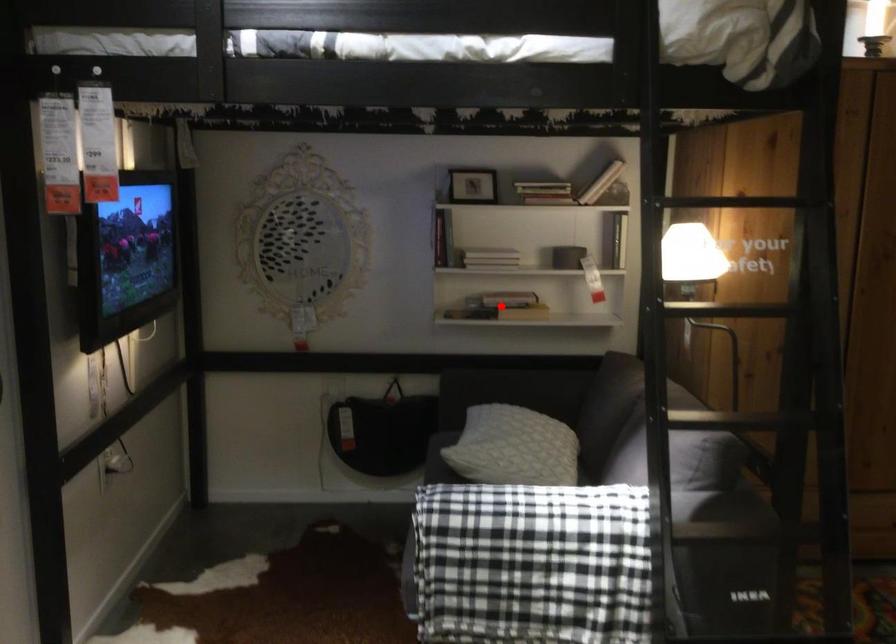
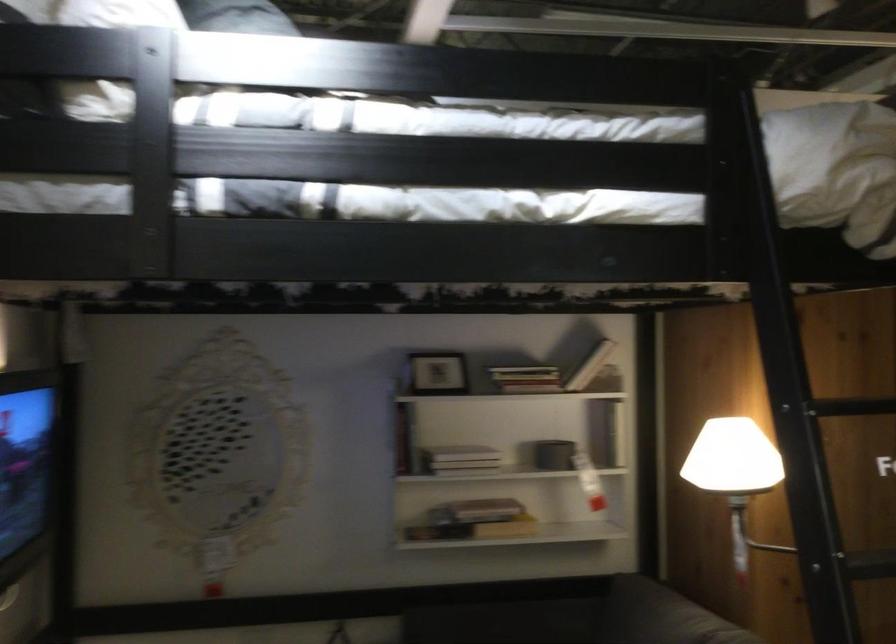
Question: I am providing you with two images of the same scene from different viewpoints. A red point is marked on the first image. Can you still see the location of the red point in image 2?

Choices:
 (A) Yes
 (B) No

Answer: (A)